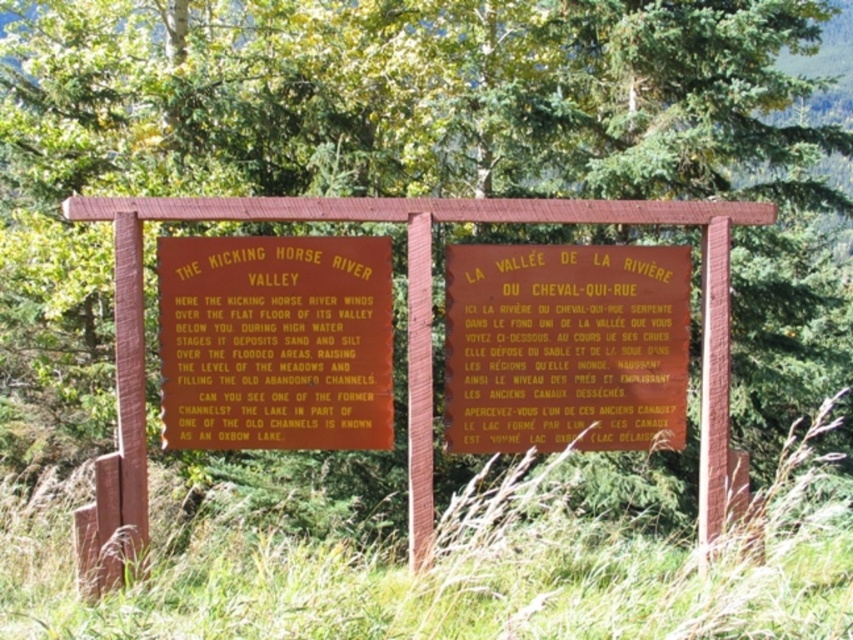
You are a hiker who wants to read both the yellow paper sign at center and the matte orange sign at center. Which sign do you need to look up at more to read?

The matte orange sign at center is taller than the yellow paper sign at center, so you need to look up more to read the matte orange sign at center.

You are a hiker who wants to place a small backpack on the ground between the green grass at lower center and the yellow paper sign at center. Based on the scene description, can you determine if there is enough space to place the backpack without it overlapping either object?

The green grass at lower center might be wider than yellow paper sign at center, so there could be sufficient space between them to place the backpack without overlapping either object. However, the exact width isn not specified, so it depends on the actual distance between them.

You are standing in front of the two wooden signs mounted on a red metal frame. You notice a green grass area at lower center. What are the coordinates of the green grass at lower center?

The coordinates of the green grass at lower center are at point (462,572).